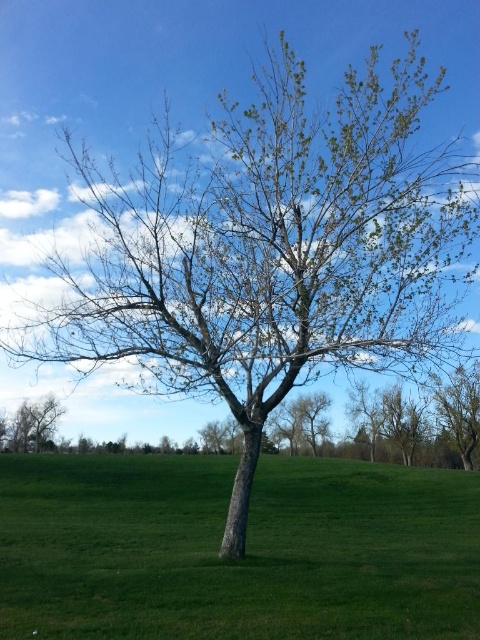
Question: Does green grass at center appear on the left side of green matte tree at lower left?

Choices:
 (A) no
 (B) yes

Answer: (A)

Question: Can you confirm if green grass at center is wider than green matte tree at lower left?

Choices:
 (A) yes
 (B) no

Answer: (A)

Question: Is green grass at center above green matte tree at lower left?

Choices:
 (A) yes
 (B) no

Answer: (A)

Question: Among these points, which one is farthest from the camera?

Choices:
 (A) [x=36, y=413]
 (B) [x=290, y=470]

Answer: (A)

Question: Which point appears farthest from the camera in this image?

Choices:
 (A) [38, 410]
 (B) [36, 474]

Answer: (A)